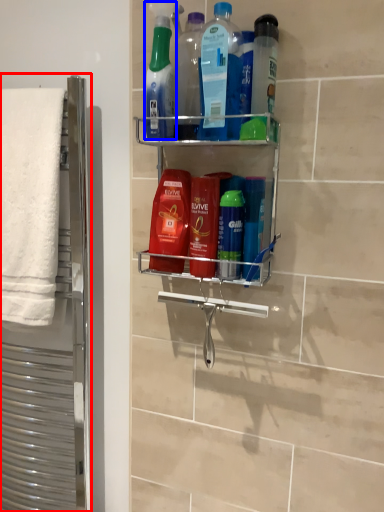
Question: Which point is further to the camera, screen door (highlighted by a red box) or cleaning product (highlighted by a blue box)?

Choices:
 (A) screen door
 (B) cleaning product

Answer: (A)